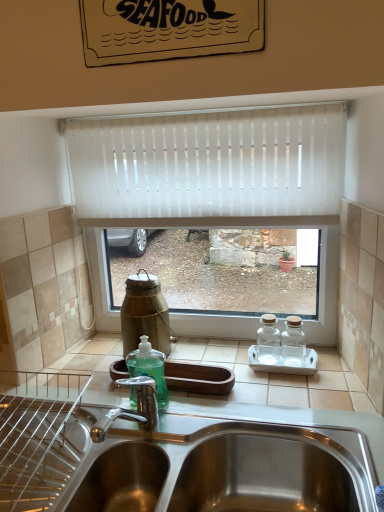
Question: Do you think green glass bottle at center is within stainless steel sink at lower center, or outside of it?

Choices:
 (A) inside
 (B) outside

Answer: (B)

Question: From the image's perspective, relative to stainless steel sink at lower center, is green glass bottle at center above or below?

Choices:
 (A) above
 (B) below

Answer: (A)

Question: Based on their relative distances, which object is nearer to the stainless steel sink at lower center?

Choices:
 (A) white vertical blinds at center
 (B) green glass bottle at center

Answer: (B)

Question: Which object is positioned closest to the white vertical blinds at center?

Choices:
 (A) stainless steel sink at lower center
 (B) green glass bottle at center

Answer: (B)